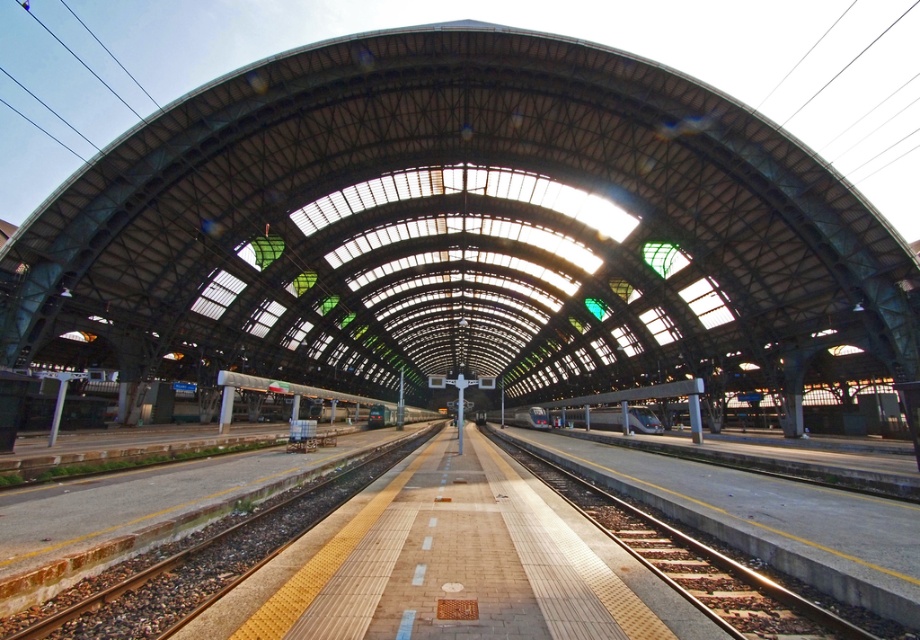
Does green metallic train at center have a lesser height compared to silver metallic train at center?

Incorrect, green metallic train at center's height does not fall short of silver metallic train at center's.

Does green metallic train at center appear on the left side of silver metallic train at center?

Indeed, green metallic train at center is positioned on the left side of silver metallic train at center.

The height and width of the screenshot is (640, 920). I want to click on green metallic train at center, so click(288, 387).

Is smooth concrete train track at center to the left of silver metallic train at center from the viewer's perspective?

Indeed, smooth concrete train track at center is positioned on the left side of silver metallic train at center.

How much distance is there between smooth concrete train track at center and silver metallic train at center?

smooth concrete train track at center is 74.55 feet away from silver metallic train at center.

Which is behind, point (823, 627) or point (641, 413)?

Positioned behind is point (641, 413).

The width and height of the screenshot is (920, 640). I want to click on smooth concrete train track at center, so click(692, 563).

Locate an element on the screen. The height and width of the screenshot is (640, 920). smooth concrete train track at center is located at coordinates (692, 563).

Is point (669, 547) positioned behind point (345, 394)?

No, it is not.

Does point (679, 568) come behind point (301, 390)?

No, it is not.

What are the coordinates of `smooth concrete train track at center` in the screenshot? It's located at (692, 563).